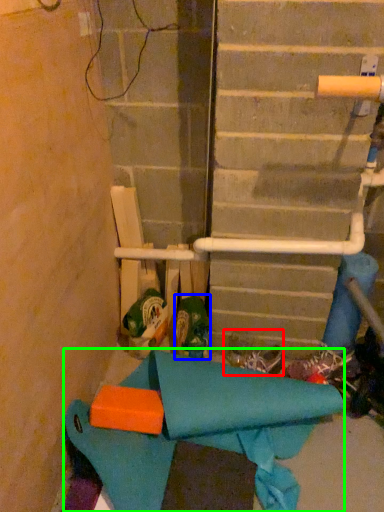
Question: Which is nearer to the footwear (highlighted by a red box)? footwear (highlighted by a blue box) or fabric (highlighted by a green box).

Choices:
 (A) footwear
 (B) fabric

Answer: (A)